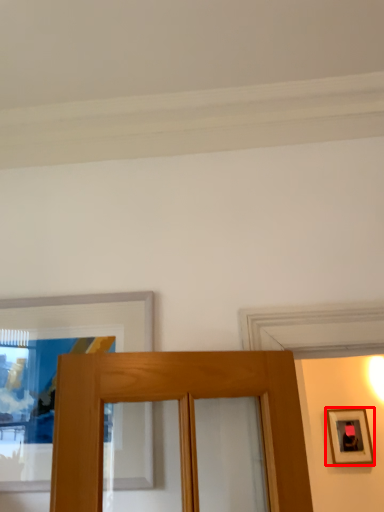
Question: From the image's perspective, considering the relative positions of picture frame (annotated by the red box) and picture frame in the image provided, where is picture frame (annotated by the red box) located with respect to the staircase?

Choices:
 (A) above
 (B) below

Answer: (B)